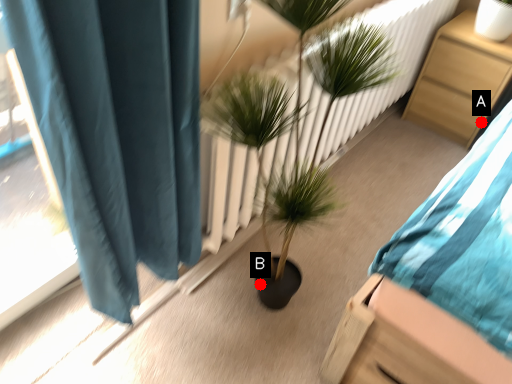
Question: Two points are circled on the image, labeled by A and B beside each circle. Among these points, which one is farthest from the camera?

Choices:
 (A) A is further
 (B) B is further

Answer: (A)